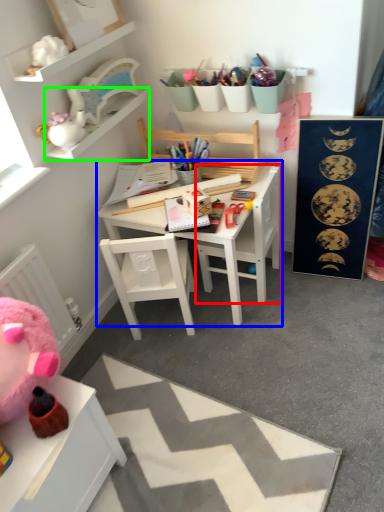
Question: Which object is positioned closest to changing table (highlighted by a red box)? Select from table (highlighted by a blue box) and cabinet (highlighted by a green box).

Choices:
 (A) table
 (B) cabinet

Answer: (A)